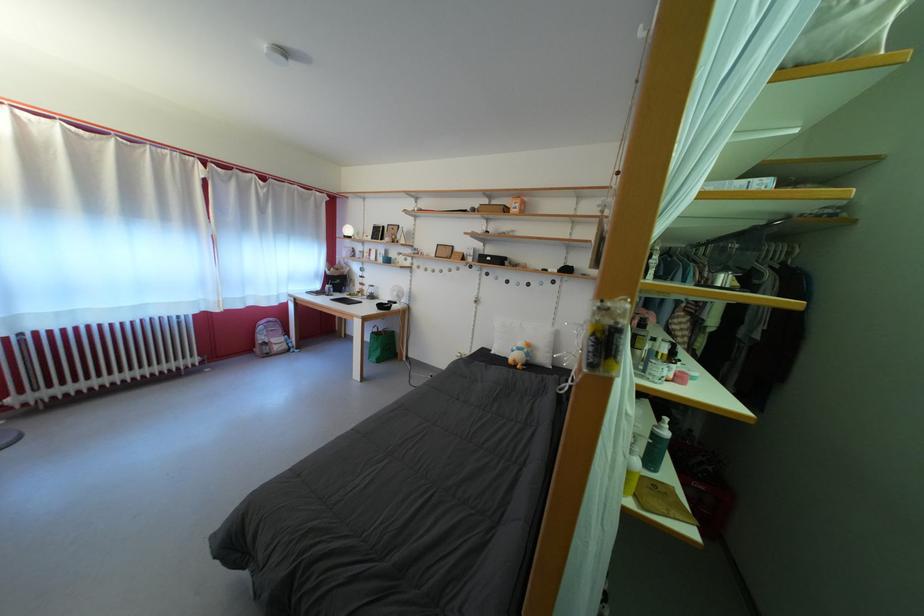
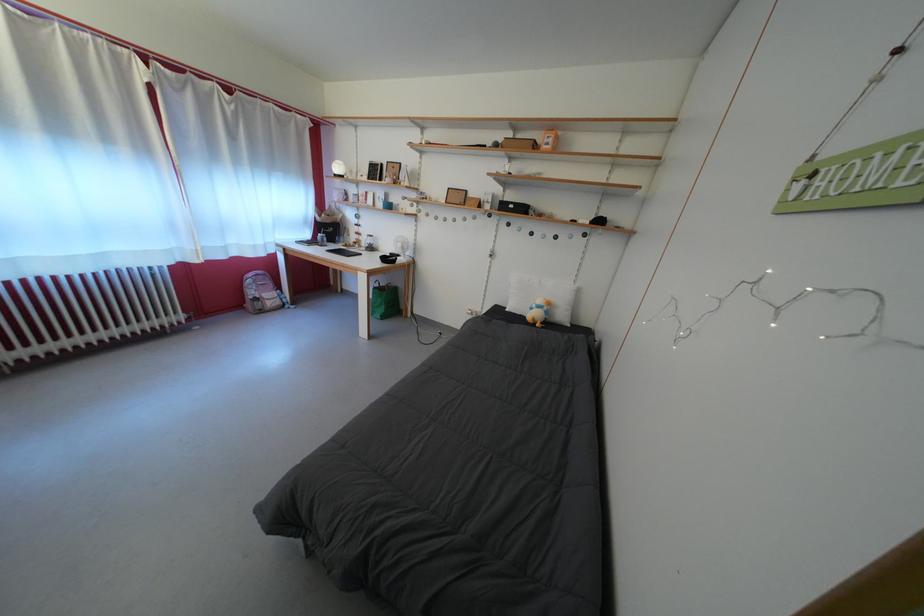
Locate, in the second image, the point that corresponds to (382,339) in the first image.

(383, 294)